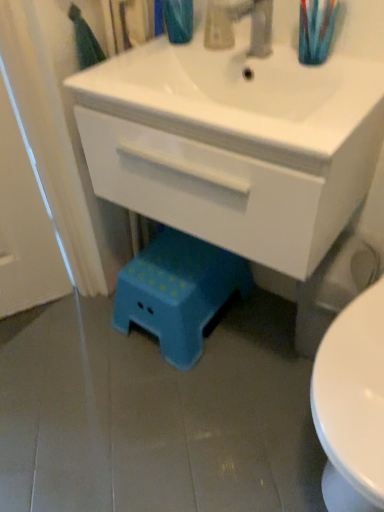
Question: Can you confirm if blue plastic step stool at lower center is bigger than translucent plastic soap dispenser at upper center?

Choices:
 (A) no
 (B) yes

Answer: (B)

Question: From a real-world perspective, is blue plastic step stool at lower center physically above translucent plastic soap dispenser at upper center?

Choices:
 (A) no
 (B) yes

Answer: (A)

Question: Does blue plastic step stool at lower center come behind translucent plastic soap dispenser at upper center?

Choices:
 (A) no
 (B) yes

Answer: (B)

Question: From the image's perspective, does blue plastic step stool at lower center appear higher than translucent plastic soap dispenser at upper center?

Choices:
 (A) no
 (B) yes

Answer: (A)

Question: Is blue plastic step stool at lower center facing away from translucent plastic soap dispenser at upper center?

Choices:
 (A) no
 (B) yes

Answer: (A)

Question: Is blue plastic step stool at lower center smaller than translucent plastic soap dispenser at upper center?

Choices:
 (A) yes
 (B) no

Answer: (B)

Question: Does white glossy cabinet at center have a greater width compared to teal plastic stool at lower center?

Choices:
 (A) no
 (B) yes

Answer: (B)

Question: Is white glossy cabinet at center smaller than teal plastic stool at lower center?

Choices:
 (A) yes
 (B) no

Answer: (B)

Question: Is white glossy cabinet at center at the left side of teal plastic stool at lower center?

Choices:
 (A) no
 (B) yes

Answer: (A)

Question: From a real-world perspective, is white glossy cabinet at center physically below teal plastic stool at lower center?

Choices:
 (A) yes
 (B) no

Answer: (A)

Question: Is white glossy cabinet at center oriented towards teal plastic stool at lower center?

Choices:
 (A) yes
 (B) no

Answer: (B)

Question: Is white glossy cabinet at center bigger than teal plastic stool at lower center?

Choices:
 (A) yes
 (B) no

Answer: (A)

Question: From a real-world perspective, is translucent plastic toothbrush at upper right physically below translucent plastic soap dispenser at upper center?

Choices:
 (A) no
 (B) yes

Answer: (A)